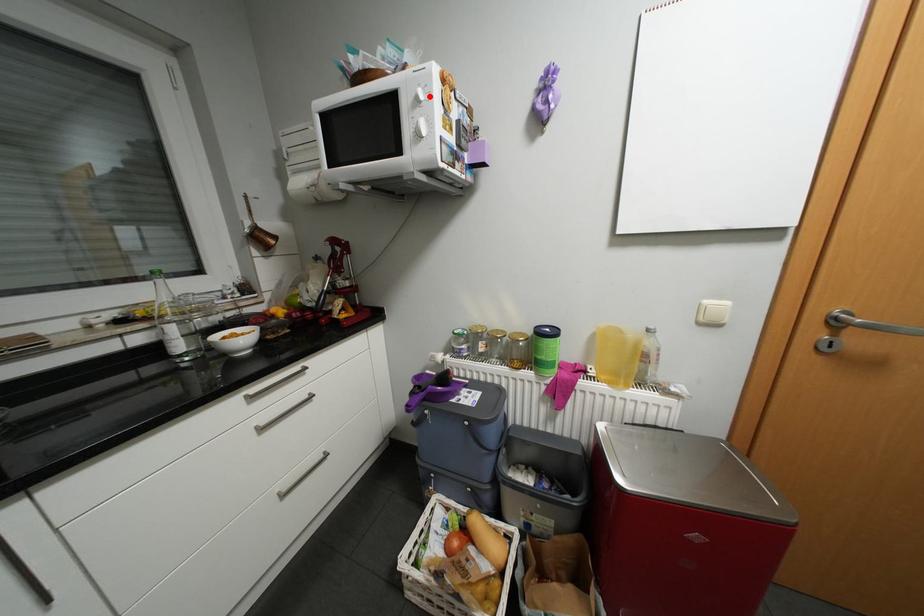
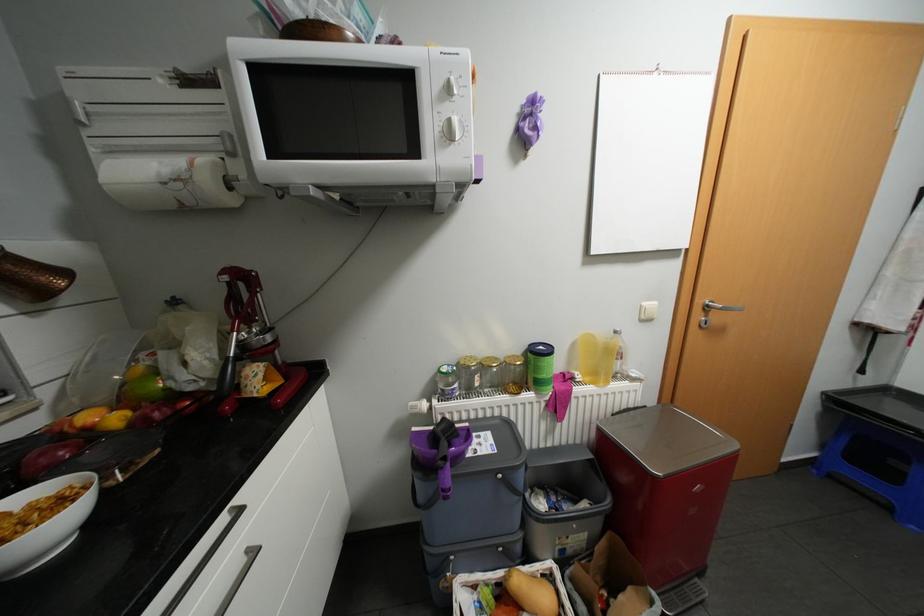
Where in the second image is the point corresponding to the highlighted location from the first image?

(463, 89)